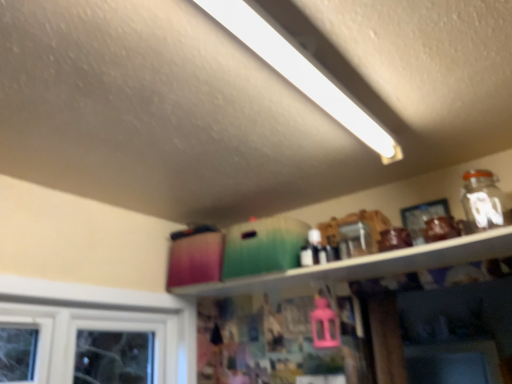
What is the approximate width of matte green container at upper center?

matte green container at upper center is 11.35 inches wide.

Describe the element at coordinates (367, 265) in the screenshot. The width and height of the screenshot is (512, 384). I see `matte green container at upper center` at that location.

The image size is (512, 384). Find the location of `matte green container at upper center`. matte green container at upper center is located at coordinates (367, 265).

What do you see at coordinates (300, 73) in the screenshot?
I see `white fluorescent tube at upper center` at bounding box center [300, 73].

In order to face white fluorescent tube at upper center, should I rotate leftwards or rightwards?

Turn right approximately 7.822 degrees to face it.

Locate an element on the screen. The width and height of the screenshot is (512, 384). white fluorescent tube at upper center is located at coordinates (300, 73).

What are the coordinates of `matte green container at upper center` in the screenshot? It's located at (367, 265).

Is white fluorescent tube at upper center at the right side of matte green container at upper center?

No, white fluorescent tube at upper center is not to the right of matte green container at upper center.

Is white fluorescent tube at upper center behind matte green container at upper center?

No, it is in front of matte green container at upper center.

Which is behind, point (230, 14) or point (349, 263)?

The point (349, 263) is farther from the camera.

From the image's perspective, which object appears higher, white fluorescent tube at upper center or matte green container at upper center?

white fluorescent tube at upper center, from the image's perspective.

From a real-world perspective, does white fluorescent tube at upper center sit lower than matte green container at upper center?

Actually, white fluorescent tube at upper center is physically above matte green container at upper center in the real world.

Considering the relative sizes of white fluorescent tube at upper center and matte green container at upper center in the image provided, is white fluorescent tube at upper center thinner than matte green container at upper center?

No.

Considering the sizes of objects white fluorescent tube at upper center and matte green container at upper center in the image provided, who is taller, white fluorescent tube at upper center or matte green container at upper center?

white fluorescent tube at upper center is taller.

Does white fluorescent tube at upper center have a smaller size compared to matte green container at upper center?

No, white fluorescent tube at upper center is not smaller than matte green container at upper center.

Choose the correct answer: Is white fluorescent tube at upper center inside matte green container at upper center or outside it?

white fluorescent tube at upper center is outside matte green container at upper center.

Would you consider white fluorescent tube at upper center to be distant from matte green container at upper center?

white fluorescent tube at upper center is near matte green container at upper center, not far away.

From the picture: Is white fluorescent tube at upper center positioned with its back to matte green container at upper center?

white fluorescent tube at upper center does not have its back to matte green container at upper center.

How many degrees apart are the facing directions of white fluorescent tube at upper center and matte green container at upper center?

white fluorescent tube at upper center and matte green container at upper center are facing 1.86 degrees away from each other.

Identify the location of shelf lying on the right of white fluorescent tube at upper center. (367, 265).

Is matte green container at upper center at the right side of white fluorescent tube at upper center?

Yes, matte green container at upper center is to the right of white fluorescent tube at upper center.

Which is in front, matte green container at upper center or white fluorescent tube at upper center?

white fluorescent tube at upper center is in front.

Which is less distant, [447,257] or [239,3]?

Point [447,257] is positioned farther from the camera compared to point [239,3].

From the image's perspective, is matte green container at upper center located beneath white fluorescent tube at upper center?

Indeed, from the image's perspective, matte green container at upper center is shown beneath white fluorescent tube at upper center.

From a real-world perspective, who is located higher, matte green container at upper center or white fluorescent tube at upper center?

In real-world perspective, white fluorescent tube at upper center is above.

Consider the image. Can you confirm if matte green container at upper center is wider than white fluorescent tube at upper center?

Incorrect, the width of matte green container at upper center does not surpass that of white fluorescent tube at upper center.

Which of these two, matte green container at upper center or white fluorescent tube at upper center, stands taller?

Standing taller between the two is white fluorescent tube at upper center.

Considering the sizes of matte green container at upper center and white fluorescent tube at upper center in the image, is matte green container at upper center bigger or smaller than white fluorescent tube at upper center?

Considering their sizes, matte green container at upper center takes up less space than white fluorescent tube at upper center.

Is white fluorescent tube at upper center a part of matte green container at upper center?

No, white fluorescent tube at upper center is not surrounded by matte green container at upper center.

Is matte green container at upper center not near white fluorescent tube at upper center?

No, matte green container at upper center is not far away from white fluorescent tube at upper center.

Is matte green container at upper center aimed at white fluorescent tube at upper center?

No, matte green container at upper center is not oriented towards white fluorescent tube at upper center.

How many degrees apart are the facing directions of matte green container at upper center and white fluorescent tube at upper center?

1.86 degrees.

Locate an element on the screen. The image size is (512, 384). light above the matte green container at upper center (from the image's perspective) is located at coordinates (300, 73).

Locate an element on the screen. The height and width of the screenshot is (384, 512). light above the matte green container at upper center (from the image's perspective) is located at coordinates (300, 73).

At what (x,y) coordinates should I click in order to perform the action: click on shelf that appears below the white fluorescent tube at upper center (from a real-world perspective). Please return your answer as a coordinate pair (x, y). Image resolution: width=512 pixels, height=384 pixels. Looking at the image, I should click on (367, 265).